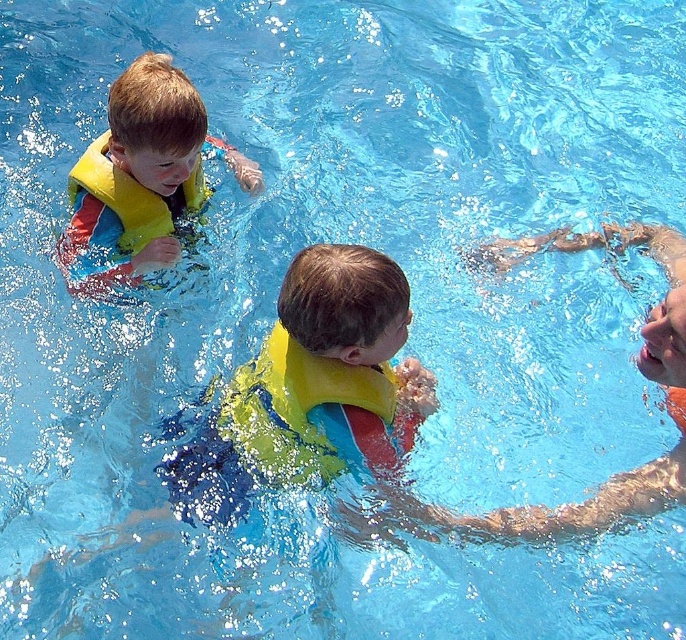
Does yellow life vest at upper left lie behind yellow life vest at center?

Yes.

Between yellow life vest at upper left and yellow life vest at center, which one appears on the right side from the viewer's perspective?

yellow life vest at center

Is point (141, 145) closer to viewer compared to point (665, 310)?

No, it is behind (665, 310).

Find the location of a particular element. The image size is (686, 640). yellow life vest at upper left is located at coordinates (141, 177).

Can you confirm if yellow life vest at upper left is positioned above yellow foam life jacket at center?

Correct, yellow life vest at upper left is located above yellow foam life jacket at center.

Based on the photo, who is more forward, (139, 99) or (283, 342)?

Point (283, 342)

Find the location of a particular element. This screenshot has height=640, width=686. yellow life vest at upper left is located at coordinates (141, 177).

Between yellow life vest at center and yellow foam life jacket at center, which one has less height?

yellow foam life jacket at center is shorter.

Which is in front, point (678, 364) or point (372, 428)?

Point (678, 364)

The width and height of the screenshot is (686, 640). In order to click on yellow life vest at center in this screenshot , I will do `click(615, 474)`.